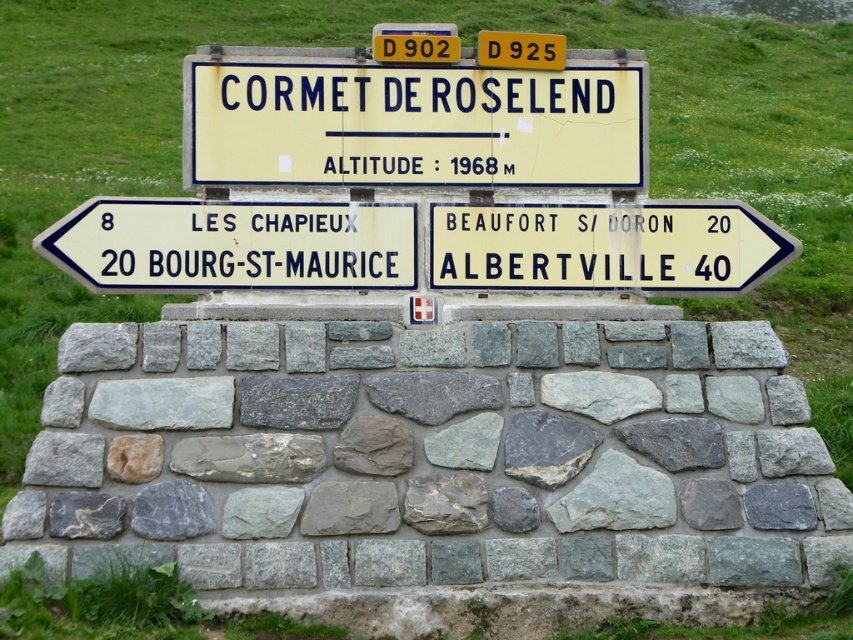
Can you confirm if gray stone wall at center is positioned above yellow plastic sign at center?

No, gray stone wall at center is not above yellow plastic sign at center.

Which is above, gray stone wall at center or yellow plastic sign at center?

yellow plastic sign at center is above.

I want to click on gray stone wall at center, so click(428, 456).

Locate an element on the screen. This screenshot has width=853, height=640. gray stone wall at center is located at coordinates (428, 456).

How far apart are white plastic sign at left and white plastic sign at right?

The distance of white plastic sign at left from white plastic sign at right is 2.00 meters.

Does white plastic sign at left have a lesser width compared to white plastic sign at right?

Correct, white plastic sign at left's width is less than white plastic sign at right's.

You are a GUI agent. You are given a task and a screenshot of the screen. Output one action in this format:
    pyautogui.click(x=<x>, y=<y>)
    Task: Click on the white plastic sign at left
    The image size is (853, 640).
    Given the screenshot: What is the action you would take?
    pyautogui.click(x=233, y=244)

Which is in front, point (397, 168) or point (80, 234)?

Point (80, 234) is more forward.

Does yellow plastic sign at center have a smaller size compared to white plastic sign at left?

No.

Which is in front, point (299, 93) or point (361, 205)?

Point (361, 205)

Find the location of a particular element. This screenshot has height=640, width=853. yellow plastic sign at center is located at coordinates (415, 124).